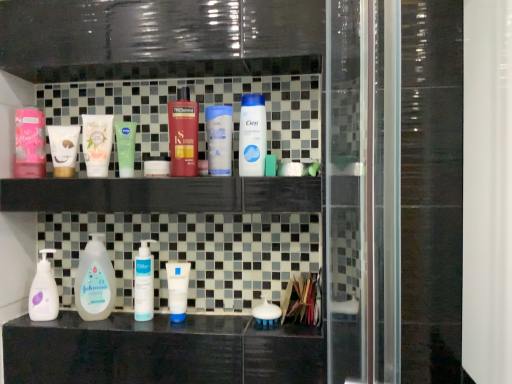
Question: In terms of width, does matte green tube at center, positioned as the first mouthwash in left-to-right order, look wider or thinner when compared to white matte pump bottle at lower left, acting as the 5th cleaning product starting from the right?

Choices:
 (A) thin
 (B) wide

Answer: (B)

Question: Considering their positions, is matte green tube at center, the first mouthwash in the top-to-bottom sequence, located in front of or behind white matte pump bottle at lower left, acting as the 5th cleaning product starting from the right?

Choices:
 (A) behind
 (B) front

Answer: (B)

Question: Estimate the real-world distances between objects in this image. Which object is farther from the white matte tube at center, arranged as the 4th toiletry when ordered from the bottom?

Choices:
 (A) white matte tube at center, placed as the 3th toiletry when sorted from top to bottom
 (B) green matte tube at upper center, marked as the second mouthwash in a right-to-left arrangement
 (C) matte pink lotion at left, the 3th toiletry ordered from the bottom
 (D) white matte pump bottle at center, which is the 3th cleaning product from left to right
 (E) white matte johnson's baby lotion at lower left, which is the 4th cleaning product in right-to-left order

Answer: (C)

Question: Which object is positioned farthest from the white matte johnson's baby lotion at lower left, which is the 4th cleaning product in right-to-left order?

Choices:
 (A) matte green tube at center, the 3th mouthwash in the bottom-to-top sequence
 (B) white matte pump bottle at center, which is the third cleaning product from right to left
 (C) white matte brush at lower right, which ranks as the 1th toiletry in bottom-to-top order
 (D) shiny red plastic bottle at center, the 4th cleaning product positioned from the left
 (E) white matte tube at center, arranged as the 4th toiletry when ordered from the bottom

Answer: (E)